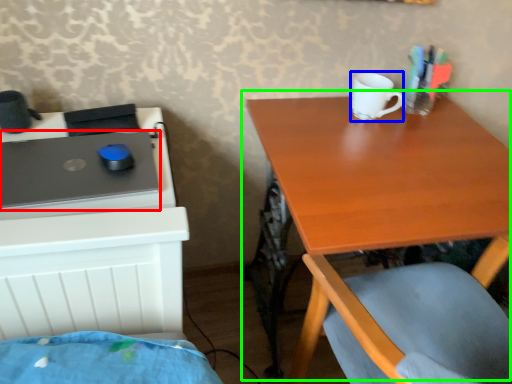
Question: Considering the real-world distances, which object is farthest from laptop (highlighted by a red box)? mug (highlighted by a blue box) or table (highlighted by a green box)?

Choices:
 (A) mug
 (B) table

Answer: (A)